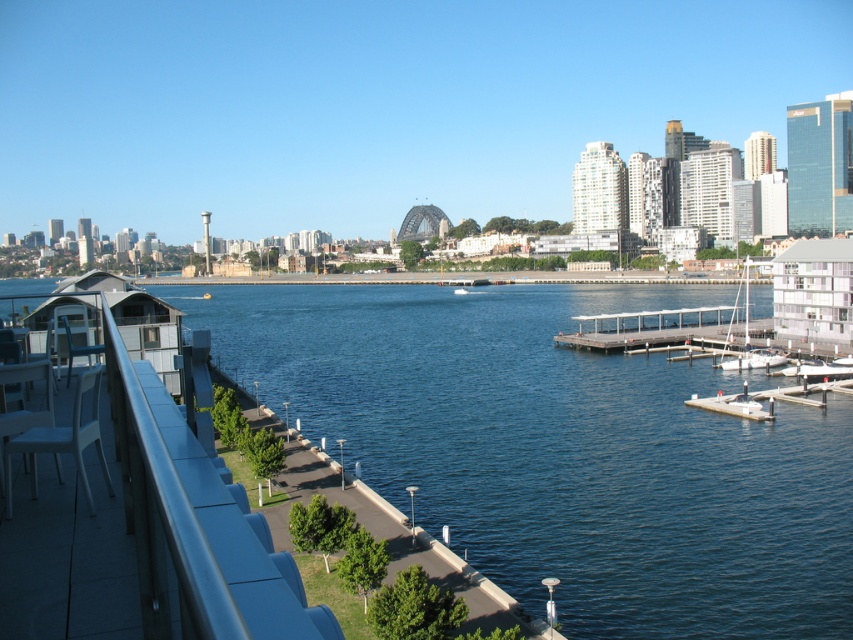
Between blue water at center and white matte sailboat at right, which one is positioned higher?

white matte sailboat at right

From the picture: Between blue water at center and white matte sailboat at right, which one has more height?

blue water at center

This screenshot has width=853, height=640. In order to click on blue water at center in this screenshot , I will do `click(561, 451)`.

Is light gray wooden dock at center bigger than white matte sailboat at right?

No.

Between light gray wooden dock at center and white matte sailboat at right, which one appears on the right side from the viewer's perspective?

white matte sailboat at right is more to the right.

Between point (672, 317) and point (762, 259), which one is positioned behind?

Point (762, 259)

Where is `light gray wooden dock at center`? The height and width of the screenshot is (640, 853). light gray wooden dock at center is located at coordinates (659, 326).

Is point (534, 364) farther from camera compared to point (608, 340)?

No, it is in front of (608, 340).

Based on the photo, is blue water at center bigger than light gray wooden dock at center?

Indeed, blue water at center has a larger size compared to light gray wooden dock at center.

Does point (709, 628) come closer to viewer compared to point (709, 326)?

Yes, it is.

I want to click on blue water at center, so tap(561, 451).